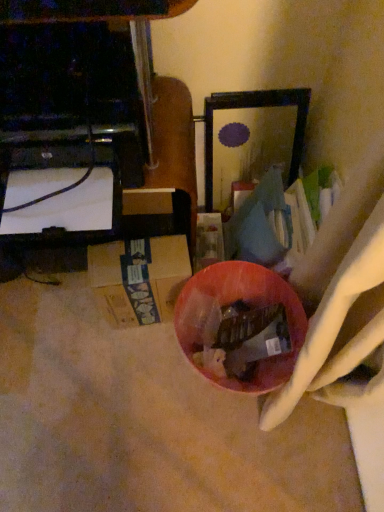
Identify the location of black glossy tv stand at left. This screenshot has width=384, height=512. (151, 103).

Describe the element at coordinates (151, 103) in the screenshot. The width and height of the screenshot is (384, 512). I see `black glossy tv stand at left` at that location.

This screenshot has width=384, height=512. What do you see at coordinates (233, 303) in the screenshot?
I see `shiny plastic bowl at center` at bounding box center [233, 303].

Identify the location of shiny plastic bowl at center. This screenshot has width=384, height=512. [233, 303].

This screenshot has width=384, height=512. In order to click on black glossy tv stand at left in this screenshot , I will do `click(151, 103)`.

Which is more to the left, shiny plastic bowl at center or black glossy tv stand at left?

black glossy tv stand at left is more to the left.

Which object is further away from the camera, shiny plastic bowl at center or black glossy tv stand at left?

Positioned behind is shiny plastic bowl at center.

Does point (186, 336) lie behind point (58, 13)?

Yes, point (186, 336) is behind point (58, 13).

From the image's perspective, would you say shiny plastic bowl at center is shown under black glossy tv stand at left?

Yes, from the image's perspective, shiny plastic bowl at center is below black glossy tv stand at left.

From a real-world perspective, is shiny plastic bowl at center over black glossy tv stand at left?

No, from a real-world perspective, shiny plastic bowl at center is not above black glossy tv stand at left.

Looking at this image, considering the sizes of shiny plastic bowl at center and black glossy tv stand at left in the image, is shiny plastic bowl at center wider or thinner than black glossy tv stand at left?

In the image, shiny plastic bowl at center appears to be more narrow than black glossy tv stand at left.

Is shiny plastic bowl at center taller than black glossy tv stand at left?

Correct, shiny plastic bowl at center is much taller as black glossy tv stand at left.

Considering the sizes of objects shiny plastic bowl at center and black glossy tv stand at left in the image provided, who is smaller, shiny plastic bowl at center or black glossy tv stand at left?

Smaller between the two is shiny plastic bowl at center.

Is shiny plastic bowl at center outside of black glossy tv stand at left?

Yes, shiny plastic bowl at center is located beyond the bounds of black glossy tv stand at left.

Does shiny plastic bowl at center touch black glossy tv stand at left?

shiny plastic bowl at center is not next to black glossy tv stand at left, and they're not touching.

Is shiny plastic bowl at center oriented away from black glossy tv stand at left?

No, black glossy tv stand at left is not at the back of shiny plastic bowl at center.

What's the angular difference between shiny plastic bowl at center and black glossy tv stand at left's facing directions?

The angle between the facing direction of shiny plastic bowl at center and the facing direction of black glossy tv stand at left is 94.2 degrees.

How distant is shiny plastic bowl at center from black glossy tv stand at left?

shiny plastic bowl at center is 12.19 inches from black glossy tv stand at left.

Locate an element on the screen. Image resolution: width=384 pixels, height=512 pixels. bowl on the right of black glossy tv stand at left is located at coordinates (233, 303).

Considering the positions of objects black glossy tv stand at left and shiny plastic bowl at center in the image provided, who is more to the right, black glossy tv stand at left or shiny plastic bowl at center?

Positioned to the right is shiny plastic bowl at center.

Which object is further away from the camera taking this photo, black glossy tv stand at left or shiny plastic bowl at center?

Positioned behind is shiny plastic bowl at center.

Does point (142, 25) come closer to viewer compared to point (247, 375)?

That is True.

From the image's perspective, would you say black glossy tv stand at left is shown under shiny plastic bowl at center?

Incorrect, from the image's perspective, black glossy tv stand at left is higher than shiny plastic bowl at center.

From a real-world perspective, is black glossy tv stand at left over shiny plastic bowl at center?

Correct, in the physical world, black glossy tv stand at left is higher than shiny plastic bowl at center.

Between black glossy tv stand at left and shiny plastic bowl at center, which one has smaller width?

Thinner between the two is shiny plastic bowl at center.

Considering the relative sizes of black glossy tv stand at left and shiny plastic bowl at center in the image provided, is black glossy tv stand at left shorter than shiny plastic bowl at center?

Yes, black glossy tv stand at left is shorter than shiny plastic bowl at center.

Which of these two, black glossy tv stand at left or shiny plastic bowl at center, is smaller?

With smaller size is shiny plastic bowl at center.

Is black glossy tv stand at left positioned beyond the bounds of shiny plastic bowl at center?

Yes, black glossy tv stand at left is not within shiny plastic bowl at center.

Would you say black glossy tv stand at left is a long distance from shiny plastic bowl at center?

black glossy tv stand at left is near shiny plastic bowl at center, not far away.

Is black glossy tv stand at left looking in the opposite direction of shiny plastic bowl at center?

No, black glossy tv stand at left is not facing the opposite direction of shiny plastic bowl at center.

Based on the photo, how different are the orientations of black glossy tv stand at left and shiny plastic bowl at center in degrees?

94.2 degrees separate the facing orientations of black glossy tv stand at left and shiny plastic bowl at center.

You are a GUI agent. You are given a task and a screenshot of the screen. Output one action in this format:
    pyautogui.click(x=<x>, y=<y>)
    Task: Click on the furniture lying above the shiny plastic bowl at center (from the image's perspective)
    
    Given the screenshot: What is the action you would take?
    pyautogui.click(x=151, y=103)

At what (x,y) coordinates should I click in order to perform the action: click on bowl located underneath the black glossy tv stand at left (from a real-world perspective). Please return your answer as a coordinate pair (x, y). Looking at the image, I should click on (233, 303).

What are the coordinates of `bowl on the right of black glossy tv stand at left` in the screenshot? It's located at coord(233,303).